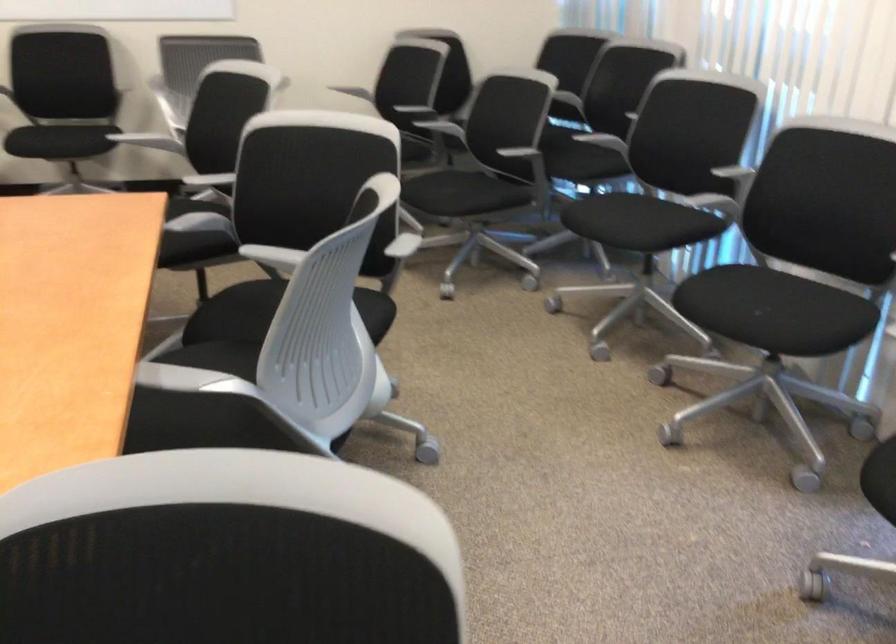
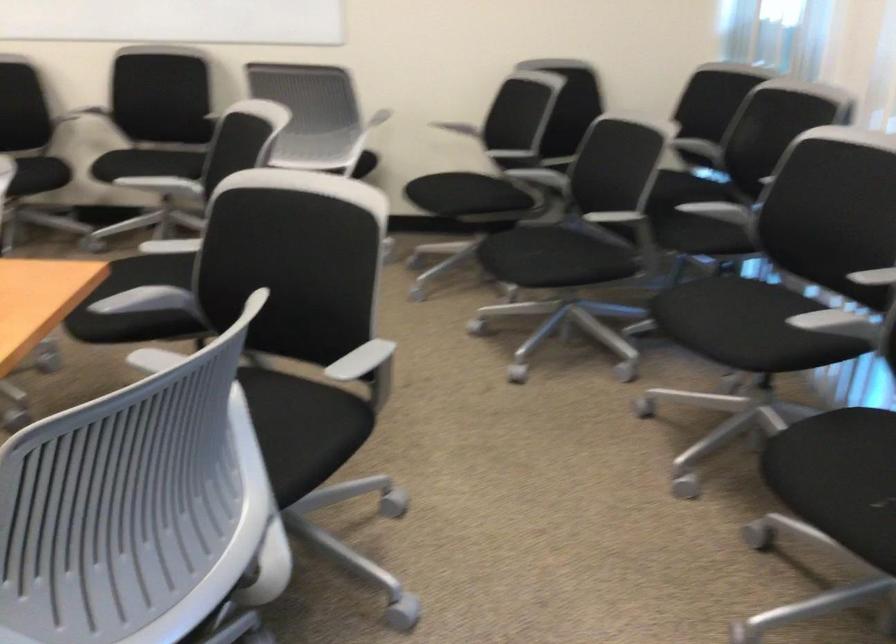
Question: The camera is either moving clockwise (left) or counter-clockwise (right) around the object. The first image is from the beginning of the video and the second image is from the end. Is the camera moving left or right when shooting the video?

Choices:
 (A) Left
 (B) Right

Answer: (B)